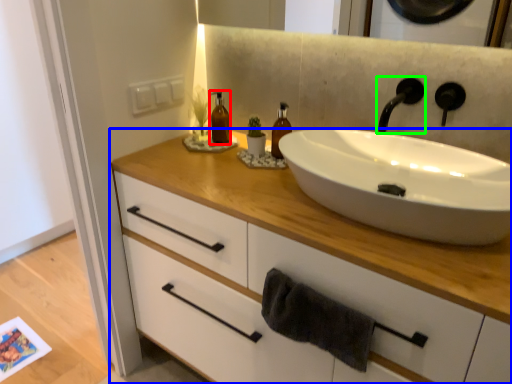
Question: Estimate the real-world distances between objects in this image. Which object is closer to bottle (highlighted by a red box), bathroom cabinet (highlighted by a blue box) or tap (highlighted by a green box)?

Choices:
 (A) bathroom cabinet
 (B) tap

Answer: (A)